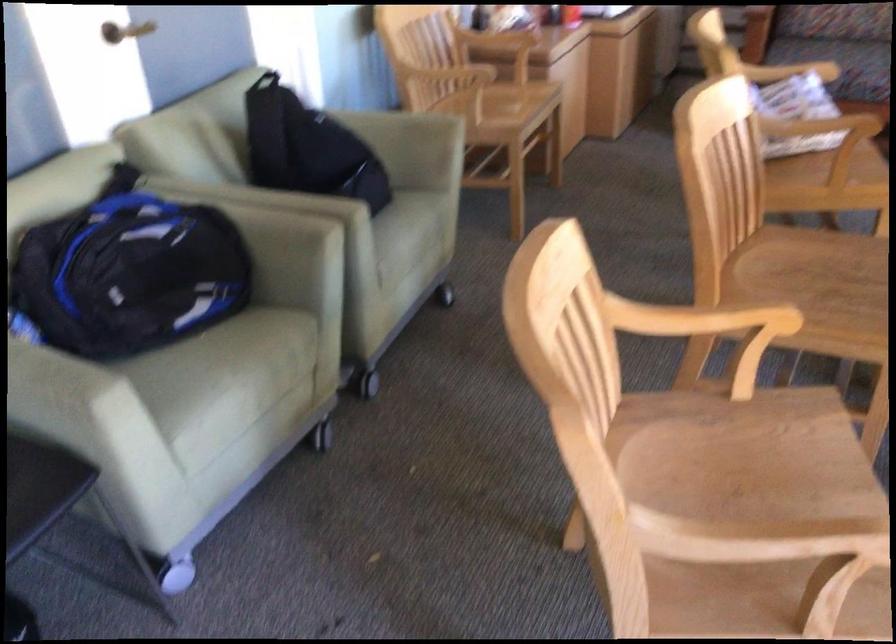
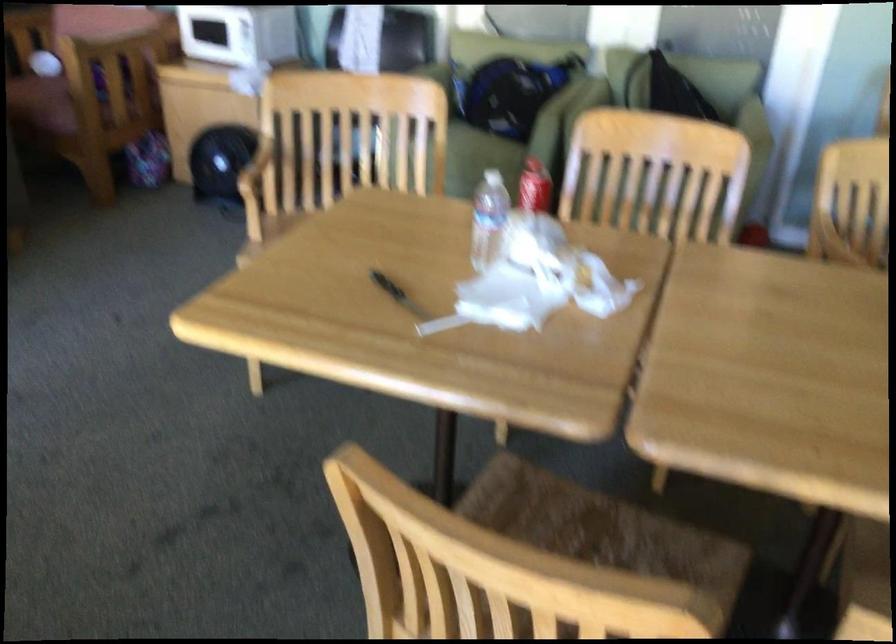
Question: I am providing you with two images of the same scene from different viewpoints. Please identify which objects are invisible in image2.

Choices:
 (A) yellow control dial
 (B) black handle knife
 (C) plastic water bottle
 (D) chair sitting surface

Answer: (D)